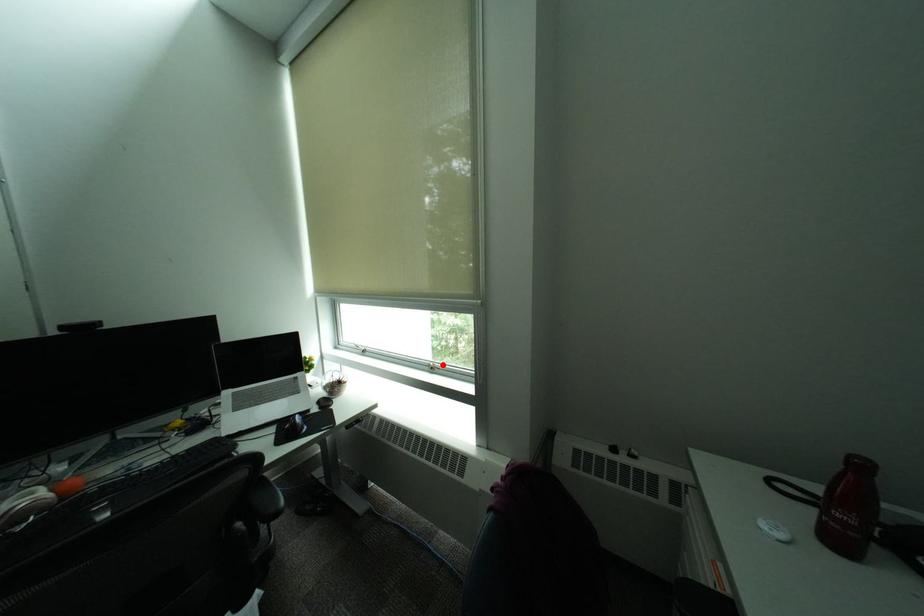
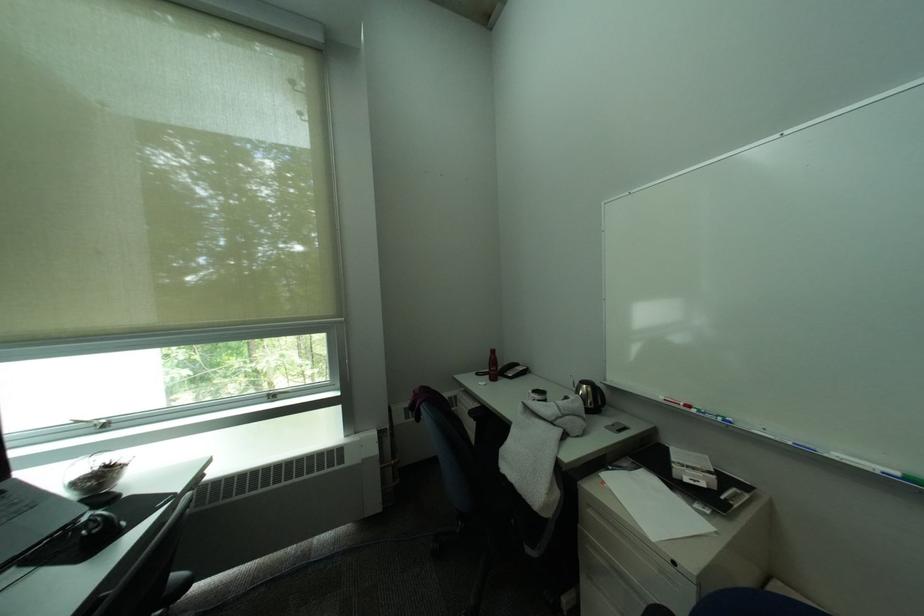
Question: I am providing you with two images of the same scene from different viewpoints. A red point is marked on the first image. Is the red point's position out of view in image 2?

Choices:
 (A) Yes
 (B) No

Answer: (B)